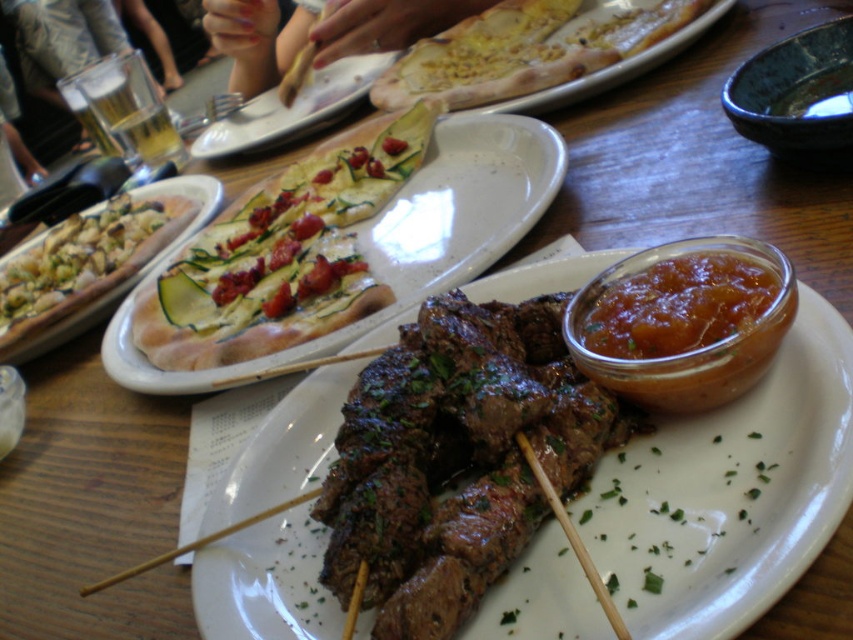
You are a guest at a dinner party and want to reach for the shiny amber jam at center right. However, there is a white ceramic platter at upper center in your way. Can you easily access the jam without moving the platter?

The white ceramic platter at upper center is closer to you than the shiny amber jam at center right, so you would need to move the platter to access the jam.

You are a guest at a dinner party and want to reach for the white ceramic platter at upper center and the matte ceramic plate at upper center. Which one is closer to you?

The white ceramic platter at upper center is taller than the matte ceramic plate at upper center, so it is closer to you.

You are a server at a restaurant and need to place a large dessert plate that is 12 inches wide on the table. Given the current arrangement, will the white ceramic platter at upper center and the shiny amber jam at center right allow enough space for the dessert plate?

The white ceramic platter at upper center has a larger width than the shiny amber jam at center right. Since the dessert plate is 12 inches wide, you should check if there is enough space between these items. However, without knowing the exact widths of the platter and jam, it is impossible to determine if the dessert plate will fit. Please measure the available space before placing the dessert plate.